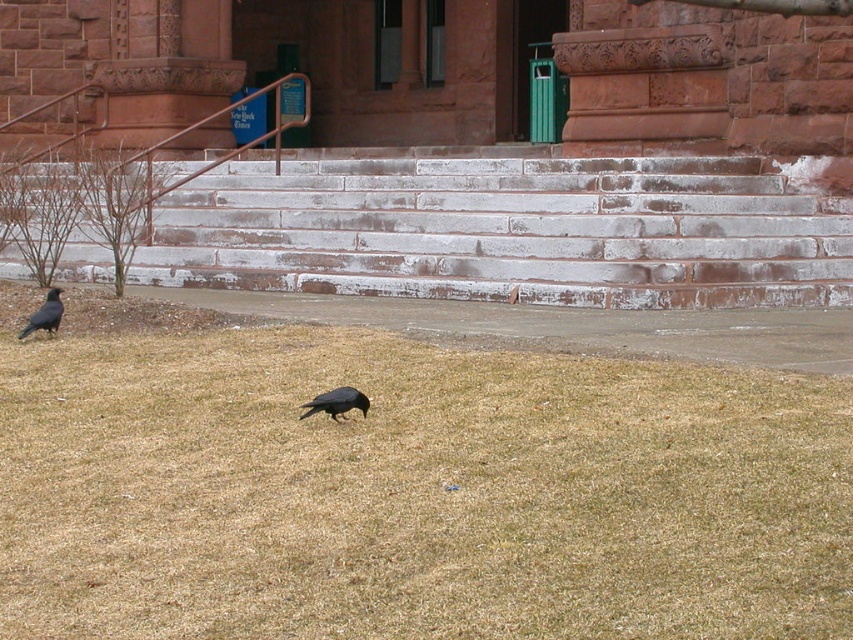
Question: Can you confirm if white stone stairs at center is bigger than black matte bird at center?

Choices:
 (A) yes
 (B) no

Answer: (B)

Question: Does brown dry grass at lower center have a lesser width compared to matte black bird at lower left?

Choices:
 (A) yes
 (B) no

Answer: (B)

Question: Does brown dry grass at lower center appear on the right side of matte black bird at lower left?

Choices:
 (A) no
 (B) yes

Answer: (B)

Question: Which point is closer to the camera?

Choices:
 (A) (42, 456)
 (B) (415, 163)
 (C) (343, 404)
 (D) (45, 307)

Answer: (A)

Question: Based on their relative distances, which object is nearer to the brown dry grass at lower center?

Choices:
 (A) black matte bird at center
 (B) matte black bird at lower left
 (C) white stone stairs at center

Answer: (A)

Question: Which object is the farthest from the white stone stairs at center?

Choices:
 (A) brown dry grass at lower center
 (B) black matte bird at center
 (C) matte black bird at lower left

Answer: (A)